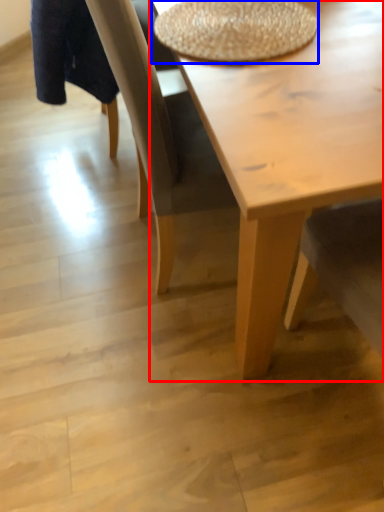
Question: Which object appears closest to the camera in this image, coffee table (highlighted by a red box) or round table (highlighted by a blue box)?

Choices:
 (A) coffee table
 (B) round table

Answer: (A)